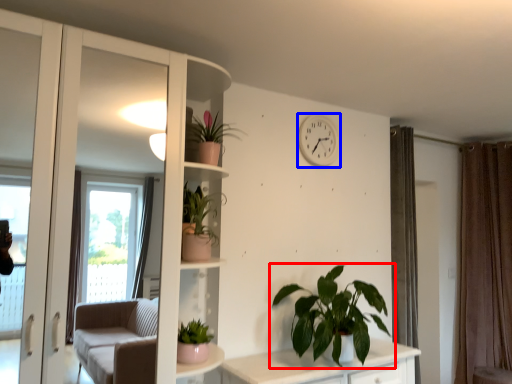
Question: Among these objects, which one is farthest to the camera, houseplant (highlighted by a red box) or clock (highlighted by a blue box)?

Choices:
 (A) houseplant
 (B) clock

Answer: (B)